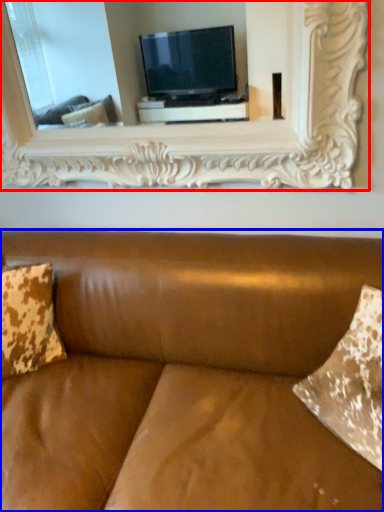
Question: Which point is further to the camera, picture frame (highlighted by a red box) or studio couch (highlighted by a blue box)?

Choices:
 (A) picture frame
 (B) studio couch

Answer: (A)